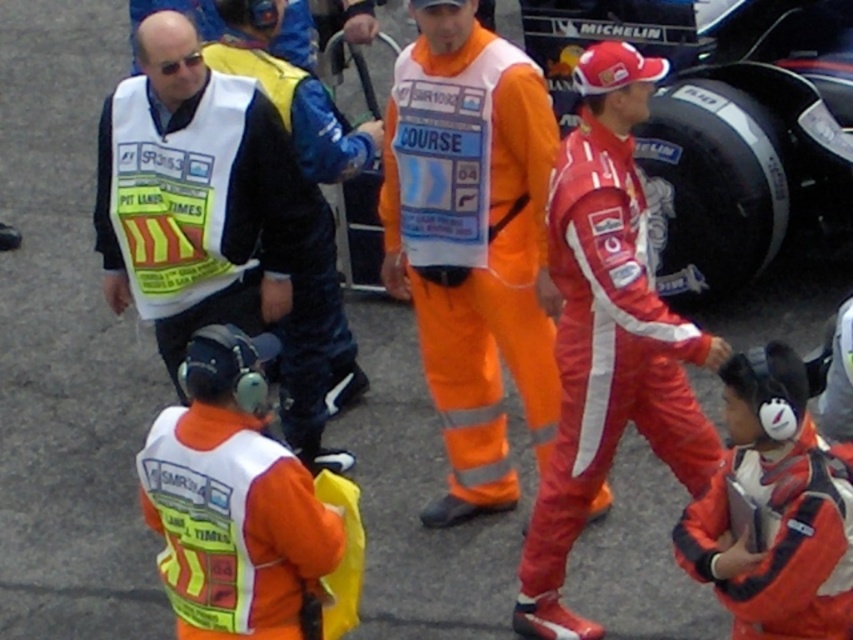
Can you confirm if orange reflective jumpsuit at center is smaller than white reflective vest at left?

Yes.

Which of these two, orange reflective jumpsuit at center or white reflective vest at left, stands taller?

Standing taller between the two is orange reflective jumpsuit at center.

Where is `orange reflective jumpsuit at center`? orange reflective jumpsuit at center is located at coordinates (473, 243).

Who is more distant from viewer, (206, 202) or (312, 284)?

The point (312, 284) is more distant.

Who is higher up, white reflective vest at left or reflective yellow vest at center?

Positioned higher is reflective yellow vest at center.

Does point (227, 308) come farther from viewer compared to point (311, 166)?

No, (227, 308) is closer to viewer.

This screenshot has width=853, height=640. I want to click on white reflective vest at left, so click(206, 211).

Who is more distant from viewer, (459, 344) or (299, 70)?

Positioned behind is point (299, 70).

Find the location of a particular element. orange reflective jumpsuit at center is located at coordinates (473, 243).

You are a GUI agent. You are given a task and a screenshot of the screen. Output one action in this format:
    pyautogui.click(x=<x>, y=<y>)
    Task: Click on the orange reflective jumpsuit at center
    The height and width of the screenshot is (640, 853).
    Given the screenshot: What is the action you would take?
    pyautogui.click(x=473, y=243)